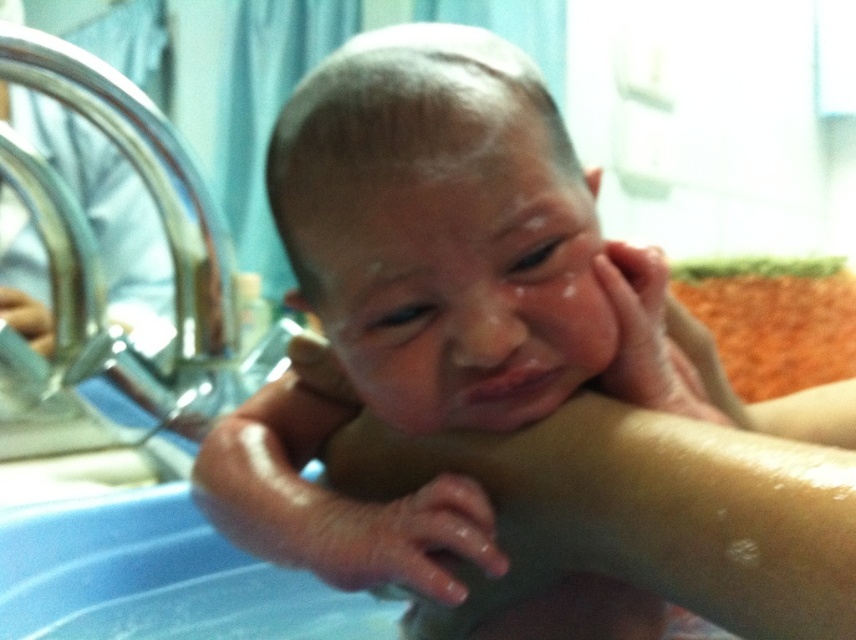
Is point (373, 536) positioned behind point (716, 401)?

That is False.

The width and height of the screenshot is (856, 640). I want to click on slightly wet skin hand at lower center, so click(x=403, y=540).

Image resolution: width=856 pixels, height=640 pixels. What do you see at coordinates (403, 540) in the screenshot?
I see `slightly wet skin hand at lower center` at bounding box center [403, 540].

Where is `slightly wet skin hand at lower center`? This screenshot has width=856, height=640. slightly wet skin hand at lower center is located at coordinates (403, 540).

Does slightly wet skin hand at lower center have a lesser width compared to metallic faucet at upper left?

Yes, slightly wet skin hand at lower center is thinner than metallic faucet at upper left.

Can you confirm if slightly wet skin hand at lower center is shorter than metallic faucet at upper left?

Yes, slightly wet skin hand at lower center is shorter than metallic faucet at upper left.

At what (x,y) coordinates should I click in order to perform the action: click on slightly wet skin hand at lower center. Please return your answer as a coordinate pair (x, y). The image size is (856, 640). Looking at the image, I should click on (403, 540).

Can you confirm if chrome metallic faucet at left is positioned above dry skin hand at center?

Correct, chrome metallic faucet at left is located above dry skin hand at center.

Which is in front, point (25, 72) or point (669, 412)?

Point (669, 412)

Is point (200, 310) farther from viewer compared to point (675, 353)?

Yes, it is.

I want to click on chrome metallic faucet at left, so click(161, 221).